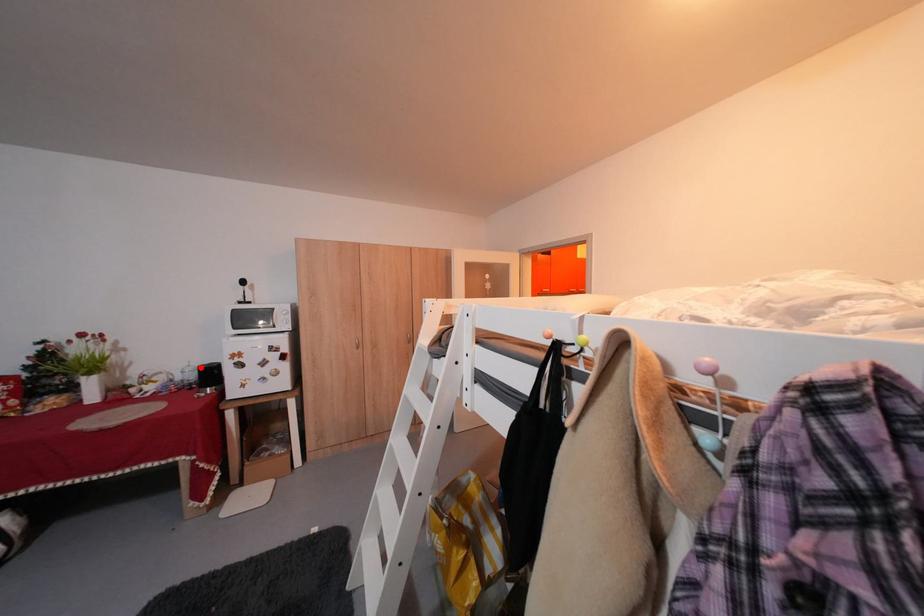
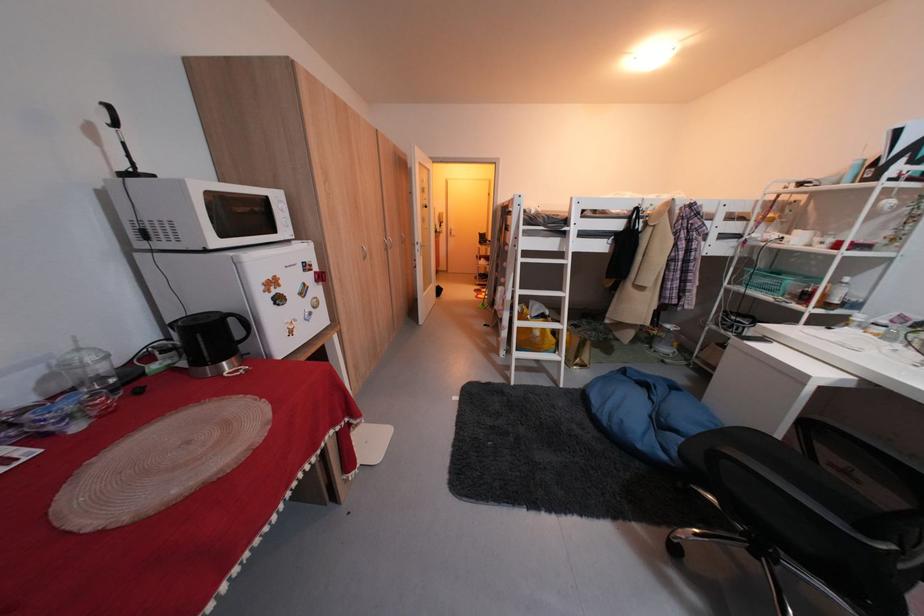
The point at the highlighted location is marked in the first image. Where is the corresponding point in the second image?

(91, 351)